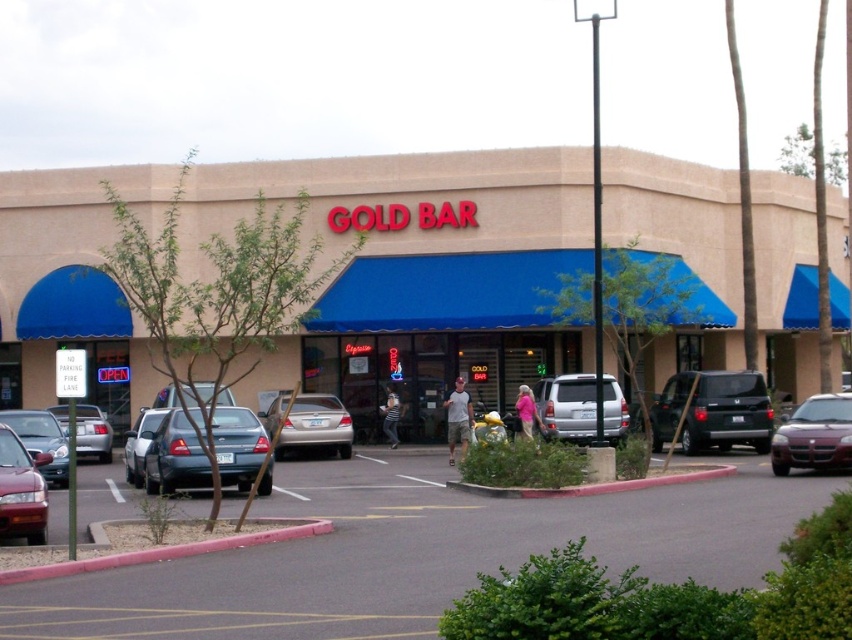
Question: Is blue awning at center below metallic silver car at center-left?

Choices:
 (A) no
 (B) yes

Answer: (A)

Question: Which point appears closest to the camera in this image?

Choices:
 (A) (699, 376)
 (B) (281, 445)
 (C) (612, 380)

Answer: (A)

Question: Observing the image, what is the correct spatial positioning of blue awning at center in reference to matte blue sedan at center-left?

Choices:
 (A) left
 (B) right

Answer: (B)

Question: Which object is farther from the camera taking this photo?

Choices:
 (A) silver metallic sedan at left
 (B) matte red car at lower left
 (C) matte silver sedan at lower left
 (D) smooth asphalt parking lot at center

Answer: (C)

Question: Is matte blue sedan at center-left to the right of silver metallic sedan at left from the viewer's perspective?

Choices:
 (A) yes
 (B) no

Answer: (A)

Question: Among these points, which one is nearest to the camera?

Choices:
 (A) (568, 429)
 (B) (271, 419)
 (C) (133, 460)

Answer: (C)